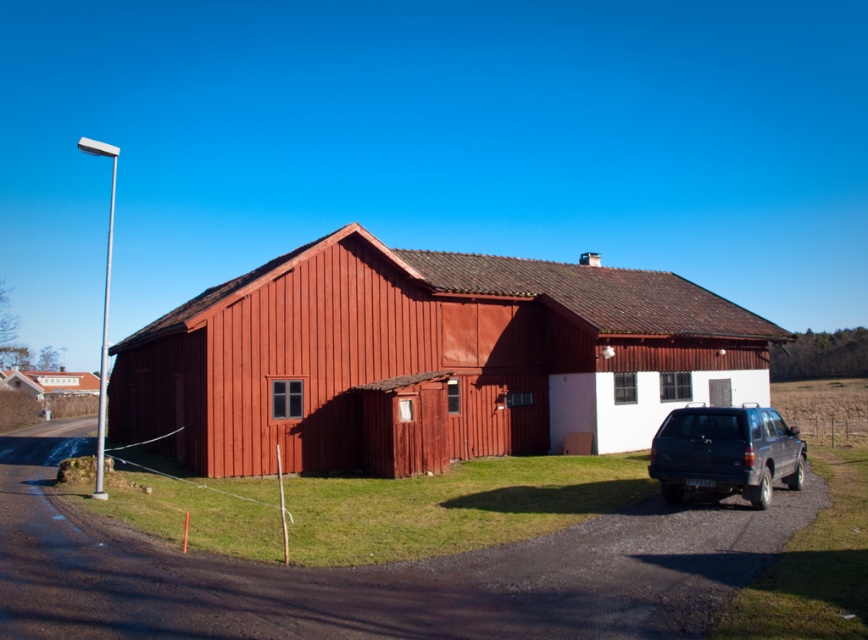
Can you confirm if smooth wooden barn at center is shorter than matte black suv at lower right?

No, smooth wooden barn at center is not shorter than matte black suv at lower right.

Does smooth wooden barn at center come behind matte black suv at lower right?

Yes, smooth wooden barn at center is further from the viewer.

Is point (127, 344) positioned in front of point (776, 468)?

No.

Locate an element on the screen. The image size is (868, 640). smooth wooden barn at center is located at coordinates (426, 355).